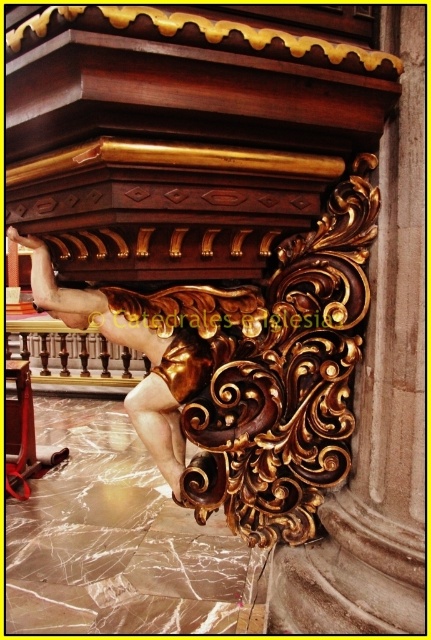
Question: Is gold polished wood carving at center closer to the viewer compared to gold polished wood deity at lower center?

Choices:
 (A) yes
 (B) no

Answer: (A)

Question: Is the position of gold polished wood carving at center less distant than that of gold polished wood deity at lower center?

Choices:
 (A) no
 (B) yes

Answer: (B)

Question: Is gold polished wood carving at center smaller than gold polished wood deity at lower center?

Choices:
 (A) no
 (B) yes

Answer: (A)

Question: Which of the following is the farthest from the observer?

Choices:
 (A) (246, 333)
 (B) (62, 298)

Answer: (A)